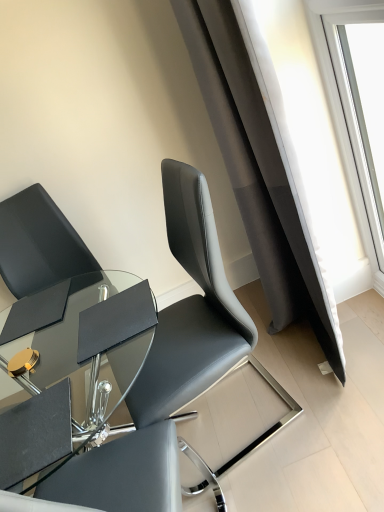
Where is `vacant area situated below matte black chair at upper left, the second chair from the left (from a real-world perspective)`? The height and width of the screenshot is (512, 384). vacant area situated below matte black chair at upper left, the second chair from the left (from a real-world perspective) is located at coordinates (253, 405).